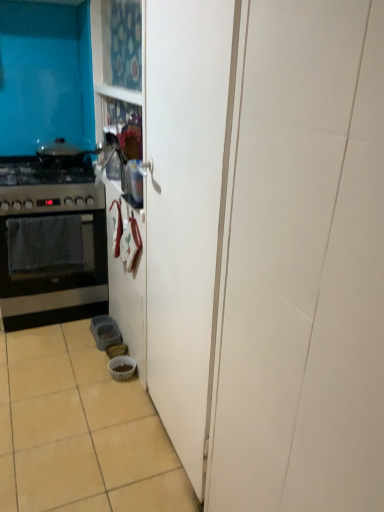
Question: Is beige ceramic tile at lower left inside or outside of white glossy bowl at lower center?

Choices:
 (A) outside
 (B) inside

Answer: (A)

Question: Considering the positions of beige ceramic tile at lower left and white glossy bowl at lower center in the image, is beige ceramic tile at lower left bigger or smaller than white glossy bowl at lower center?

Choices:
 (A) big
 (B) small

Answer: (A)

Question: Which of these objects is positioned closest to the white matte door at center?

Choices:
 (A) black matte oven at left
 (B) white glossy bowl at lower center
 (C) stainless steel oven at left
 (D) black matte gas stove at left
 (E) beige ceramic tile at lower left

Answer: (E)

Question: Considering the real-world distances, which object is closest to the black matte gas stove at left?

Choices:
 (A) beige ceramic tile at lower left
 (B) white glossy bowl at lower center
 (C) white matte door at center
 (D) black matte oven at left
 (E) stainless steel oven at left

Answer: (E)